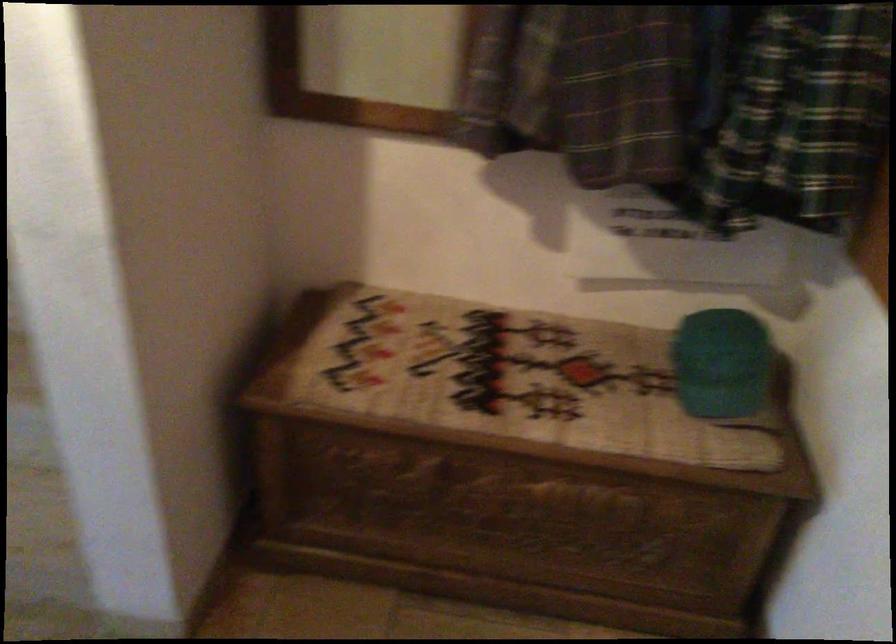
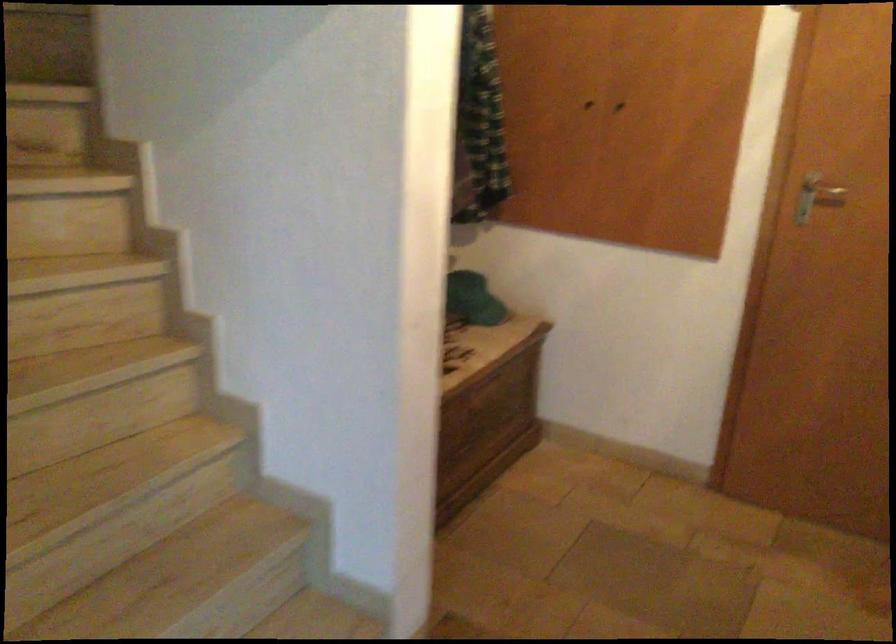
Find the pixel in the second image that matches point (701, 357) in the first image.

(472, 299)